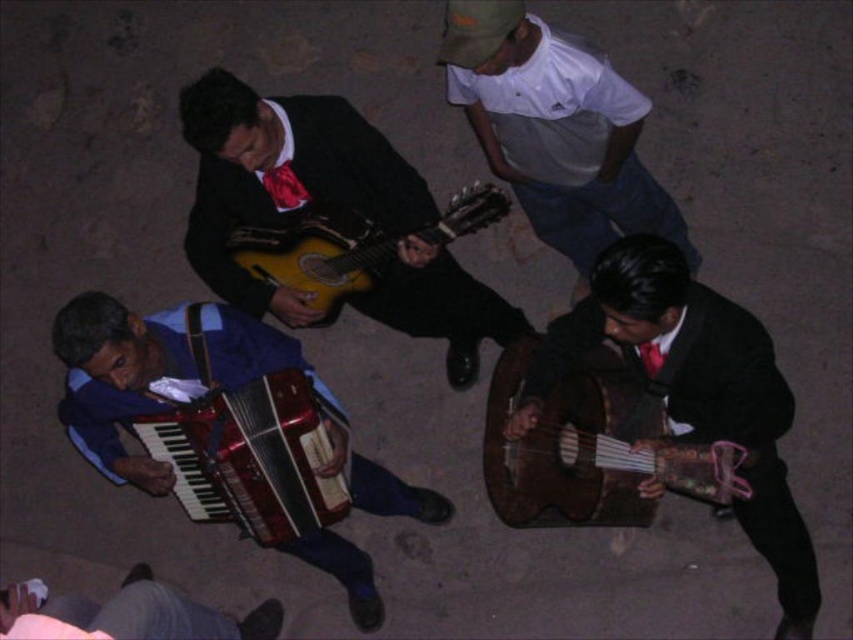
Question: Which object appears closest to the camera in this image?

Choices:
 (A) matte red tie at upper center
 (B) metallic blue accordion at lower left
 (C) red satin tie at center
 (D) matte black guitar at center

Answer: (B)

Question: Considering the relative positions of matte black guitar at center and metallic red accordion at lower left in the image provided, where is matte black guitar at center located with respect to metallic red accordion at lower left?

Choices:
 (A) right
 (B) left

Answer: (A)

Question: Which is nearer to the shiny brown guitar at right?

Choices:
 (A) red satin tie at center
 (B) metallic blue accordion at lower left
 (C) yellow matte guitar at center

Answer: (A)

Question: Does metallic blue accordion at lower left have a greater width compared to metallic red accordion at lower left?

Choices:
 (A) yes
 (B) no

Answer: (A)

Question: Does matte black guitar at center have a larger size compared to yellow matte guitar at center?

Choices:
 (A) yes
 (B) no

Answer: (A)

Question: Among these objects, which one is farthest from the camera?

Choices:
 (A) metallic blue accordion at lower left
 (B) yellow matte guitar at center
 (C) red satin tie at center
 (D) metallic red accordion at lower left

Answer: (D)